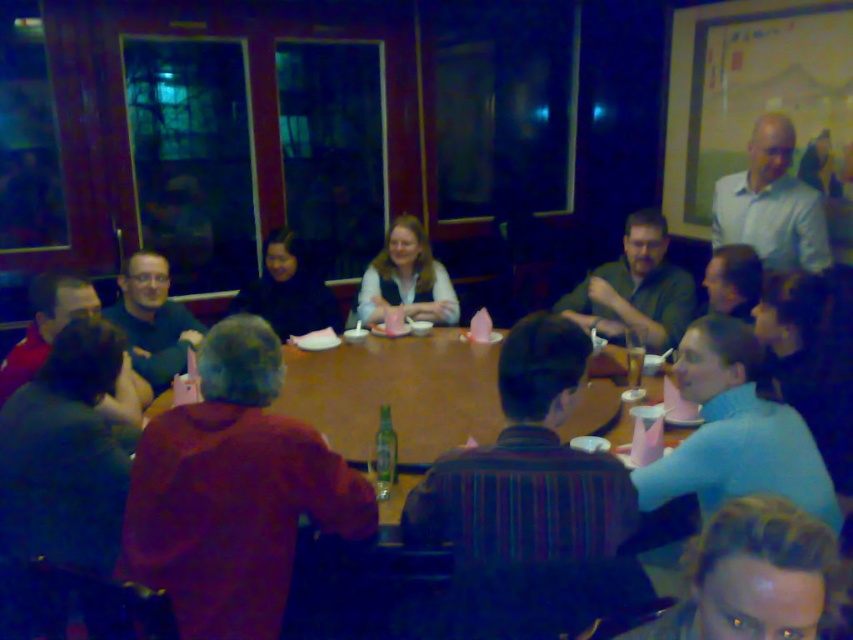
Between blue fabric shirt at lower right and dark blue shirt at center, which one has less height?

dark blue shirt at center

Who is more forward, (712,364) or (152,285)?

Point (712,364)

Image resolution: width=853 pixels, height=640 pixels. I want to click on blue fabric shirt at lower right, so click(x=734, y=433).

Is green glass bottle at center positioned before translucent glass beer at center?

Yes, it is in front of translucent glass beer at center.

Does green glass bottle at center have a smaller size compared to translucent glass beer at center?

Indeed, green glass bottle at center has a smaller size compared to translucent glass beer at center.

Between point (381, 460) and point (637, 348), which one is positioned behind?

The point (637, 348) is more distant.

This screenshot has width=853, height=640. In order to click on green glass bottle at center in this screenshot , I will do `click(384, 454)`.

Can you confirm if black matte jacket at center is positioned below green glass bottle at center?

No, black matte jacket at center is not below green glass bottle at center.

Between black matte jacket at center and green glass bottle at center, which one has less height?

With less height is green glass bottle at center.

Who is more forward, (292, 259) or (395, 474)?

Point (395, 474) is in front.

Locate an element on the screen. This screenshot has height=640, width=853. black matte jacket at center is located at coordinates (288, 291).